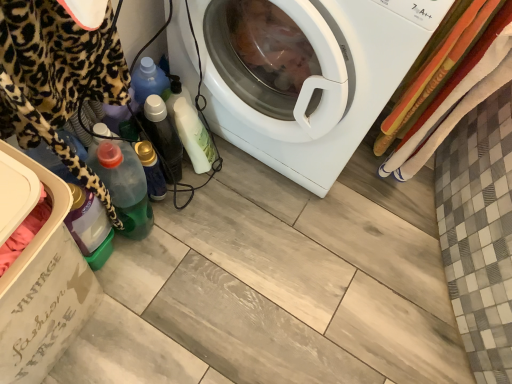
Question: Is white glossy bottle at center, placed as the 1th bottle when sorted from top to bottom, spatially inside translucent plastic bottle at lower left, arranged as the third bottle when viewed from the top, or outside of it?

Choices:
 (A) outside
 (B) inside

Answer: (A)

Question: From the image's perspective, is white glossy bottle at center, placed as the 1th bottle when sorted from top to bottom, positioned above or below translucent plastic bottle at lower left, which is the first bottle in bottom-to-top order?

Choices:
 (A) above
 (B) below

Answer: (A)

Question: Which object is positioned farthest from the multicolored woven blanket at right?

Choices:
 (A) transparent plastic dish washer at lower left
 (B) translucent plastic bottle at lower left, which is the first bottle in bottom-to-top order
 (C) white glossy washing machine at center
 (D) white glossy bottle at center, placed as the 1th bottle when sorted from top to bottom
 (E) translucent plastic bottle at center, marked as the second bottle in a bottom-to-top arrangement

Answer: (A)

Question: Which object is positioned closest to the translucent plastic bottle at center, marked as the second bottle in a bottom-to-top arrangement?

Choices:
 (A) transparent plastic dish washer at lower left
 (B) white glossy bottle at center, placed as the 1th bottle when sorted from top to bottom
 (C) translucent plastic bottle at lower left, arranged as the third bottle when viewed from the top
 (D) white glossy washing machine at center
 (E) multicolored woven blanket at right

Answer: (B)